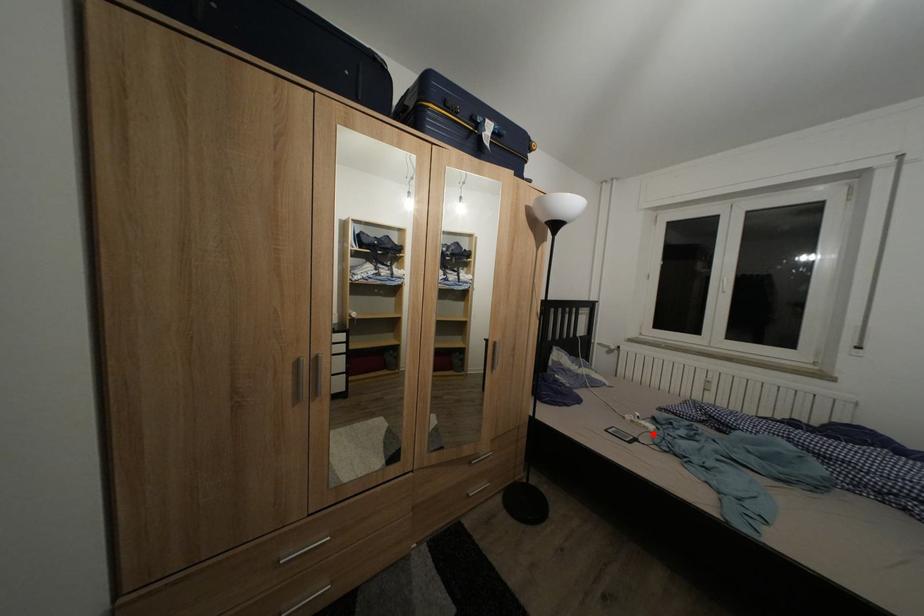
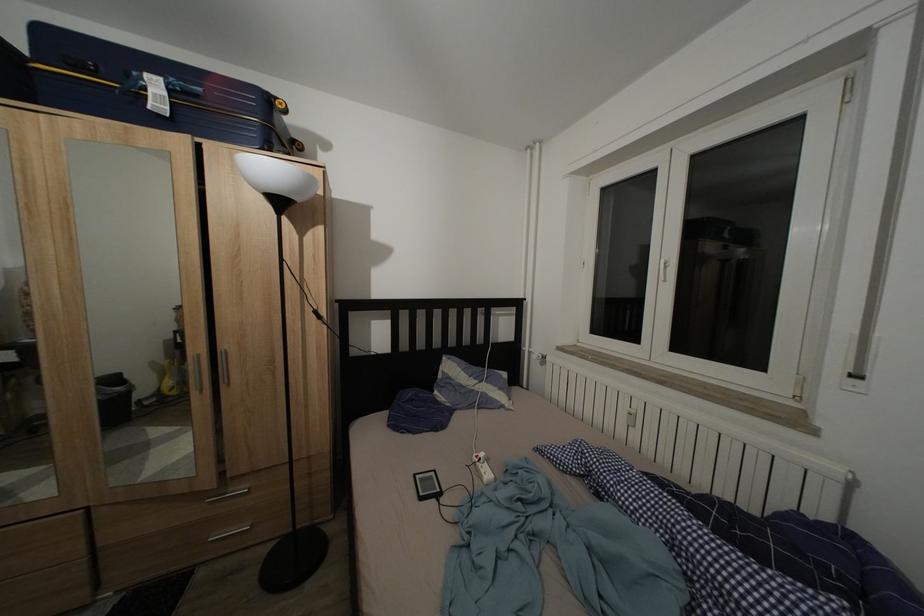
Locate, in the second image, the point that corresponds to the highlighted location in the first image.

(488, 483)